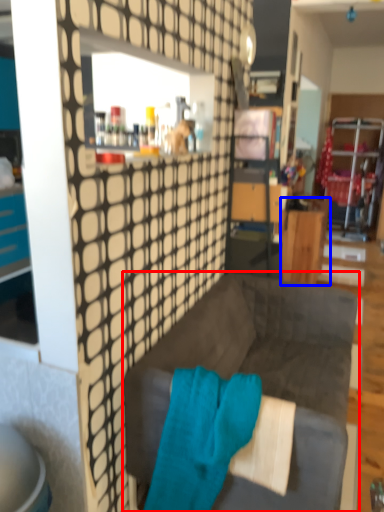
Question: Which object appears closest to the camera in this image, studio couch (highlighted by a red box) or desk (highlighted by a blue box)?

Choices:
 (A) studio couch
 (B) desk

Answer: (A)